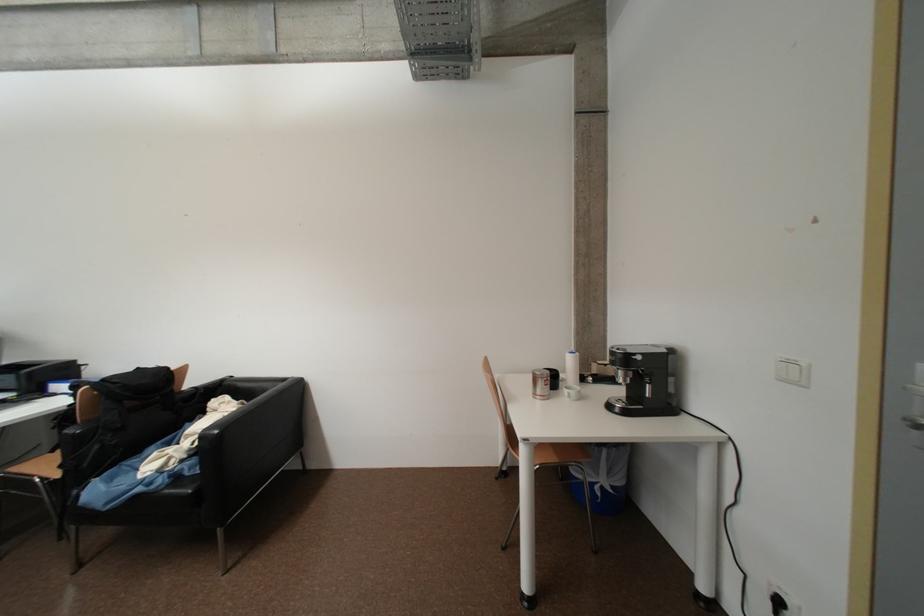
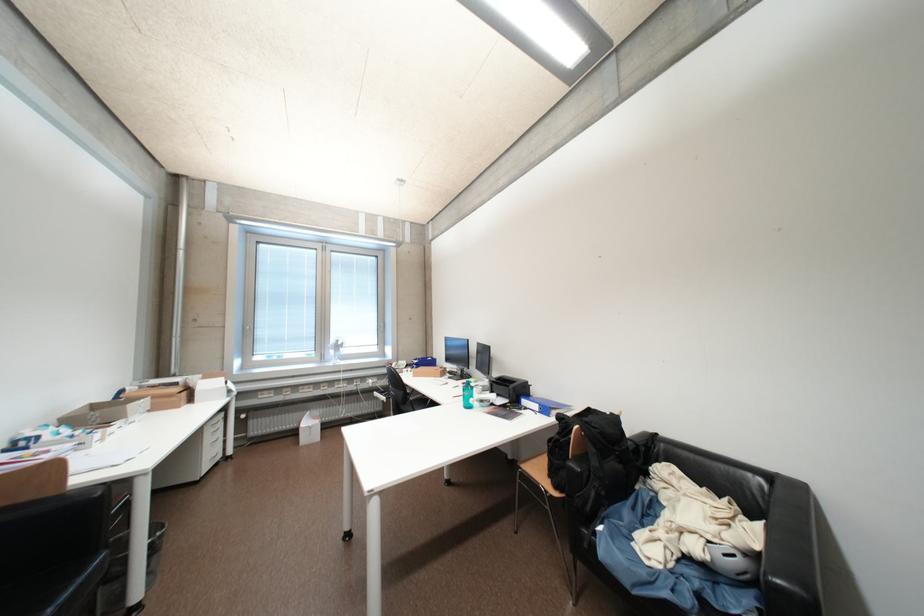
Where in the second image is the point corresponding to point (63, 397) from the first image?

(533, 411)